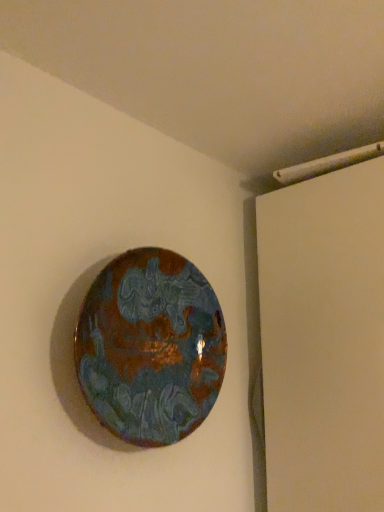
Question: Should I look upward or downward to see rustic ceramic plate at center?

Choices:
 (A) up
 (B) down

Answer: (B)